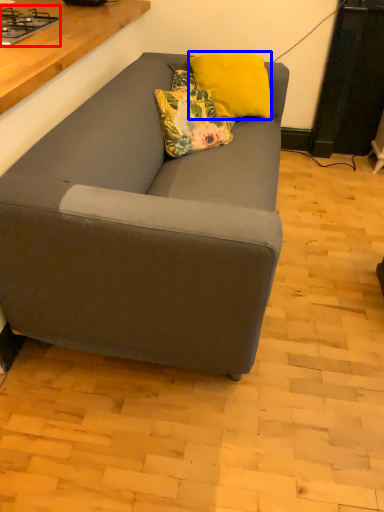
Question: Which of the following is the farthest to the observer, gas stove (highlighted by a red box) or pillow (highlighted by a blue box)?

Choices:
 (A) gas stove
 (B) pillow

Answer: (B)